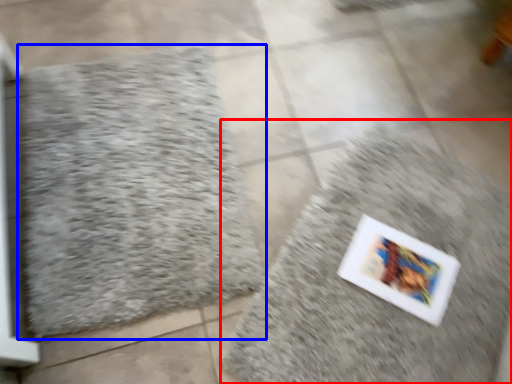
Question: Which object is further to the camera taking this photo, bath mat (highlighted by a red box) or bath mat (highlighted by a blue box)?

Choices:
 (A) bath mat
 (B) bath mat

Answer: (B)